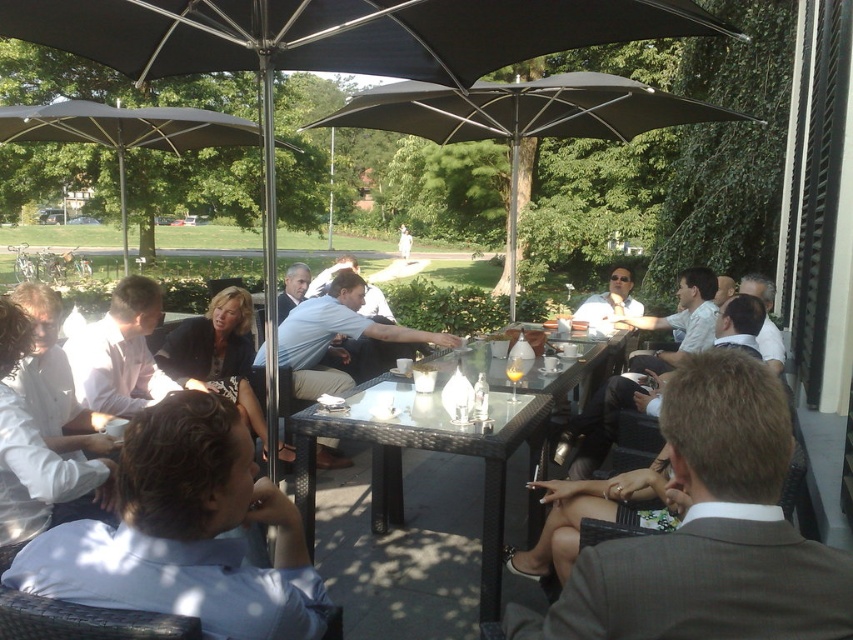
You are a photographer trying to capture a group photo of the people at the rectangular glass table. You need to ensure that both the white shirt at center and the white shirt at left are clearly visible in the frame. Based on their positions, which white shirt is more likely to be partially obscured by others in the group?

The white shirt at center might be wider than white shirt at left, so it could be more likely to be partially obscured if it occupies more space in the frame.